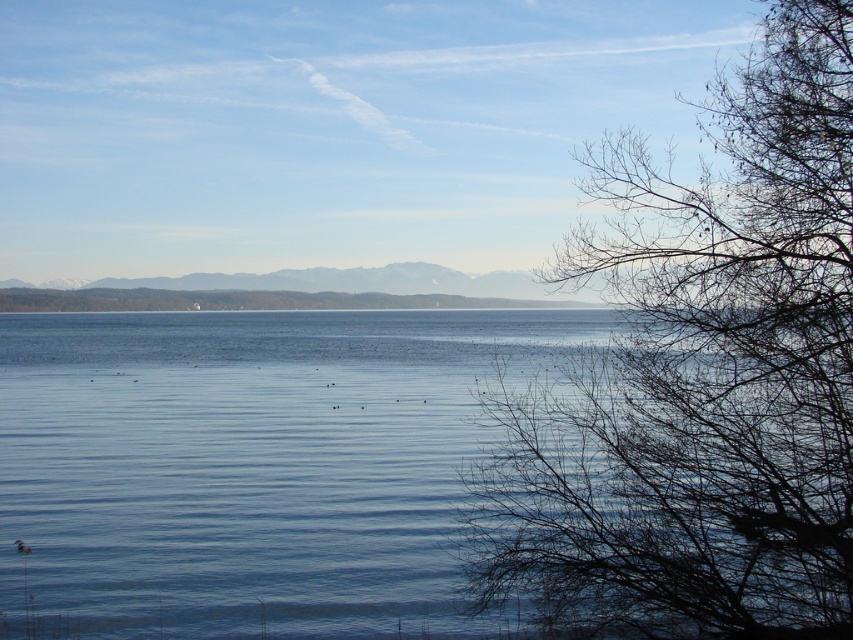
You are standing on the lakeshore and see the bare branches at right and the blue water at center. Which object is positioned to the right of the other?

The bare branches at right are positioned to the right of the blue water at center.

You are standing in the landscape scene and want to pick up an object. Which object is easier to reach, the bare branches at right or the blue water at center?

The bare branches at right are closer to the viewer than the blue water at center, so it is easier to reach the bare branches at right.

You are standing at the edge of the lake and see two points in the scene. The first point is located at coordinates point (844, 122) and the second at point (71, 522). Which point is nearer to your current position?

Point (844, 122) is closer to the camera than point (71, 522), so the first point is nearer to your current position.